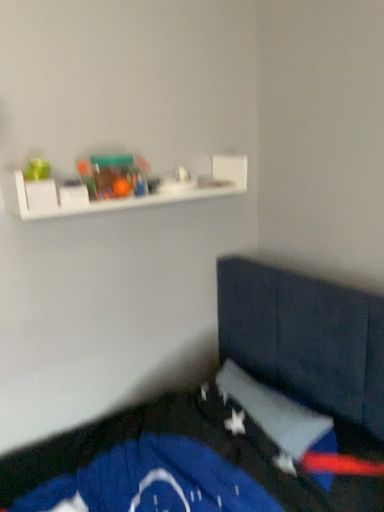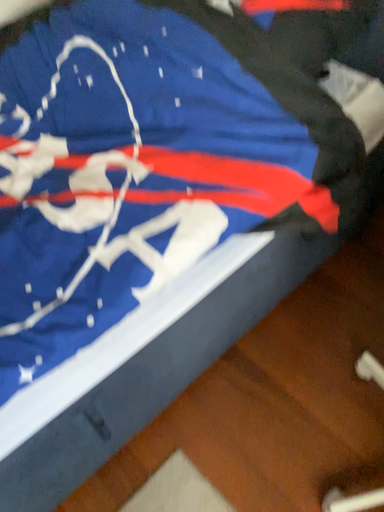
Question: How did the camera likely rotate when shooting the video?

Choices:
 (A) rotated downward
 (B) rotated upward

Answer: (A)